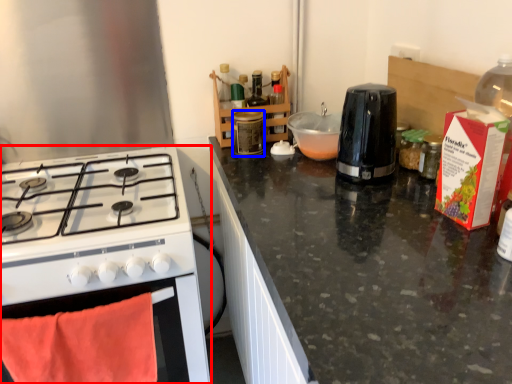
Question: Which object appears closest to the camera in this image, kitchen appliance (highlighted by a red box) or bottle (highlighted by a blue box)?

Choices:
 (A) kitchen appliance
 (B) bottle

Answer: (A)